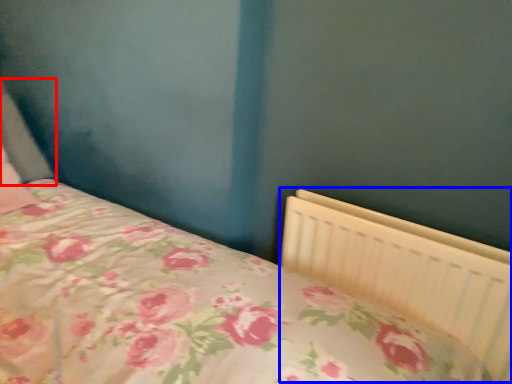
Question: Which object is further to the camera taking this photo, pillow (highlighted by a red box) or radiator (highlighted by a blue box)?

Choices:
 (A) pillow
 (B) radiator

Answer: (A)